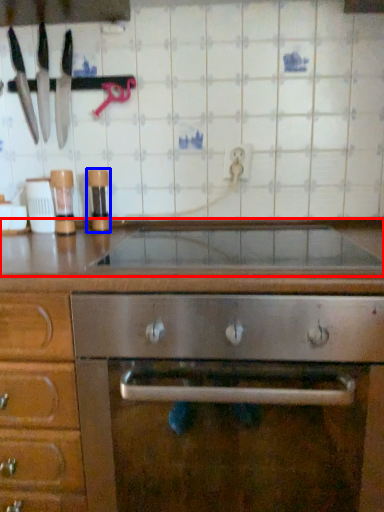
Question: Which object is further to the camera taking this photo, countertop (highlighted by a red box) or appliance (highlighted by a blue box)?

Choices:
 (A) countertop
 (B) appliance

Answer: (B)